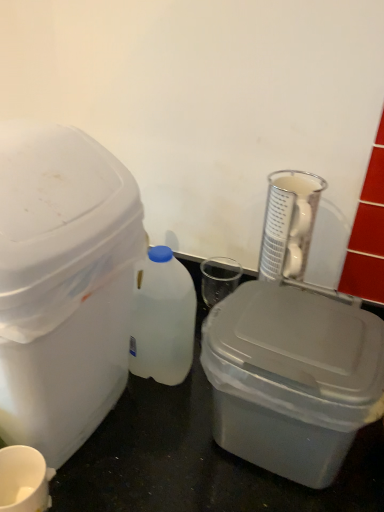
Question: From the image's perspective, is white plastic bottle at center below white matte cup at lower left?

Choices:
 (A) no
 (B) yes

Answer: (A)

Question: Does white plastic bottle at center have a lesser height compared to white matte cup at lower left?

Choices:
 (A) no
 (B) yes

Answer: (A)

Question: Is white plastic bottle at center at the left side of white matte cup at lower left?

Choices:
 (A) yes
 (B) no

Answer: (B)

Question: Considering the relative sizes of white plastic bottle at center and white matte cup at lower left in the image provided, is white plastic bottle at center bigger than white matte cup at lower left?

Choices:
 (A) yes
 (B) no

Answer: (A)

Question: Is white plastic bottle at center smaller than white matte cup at lower left?

Choices:
 (A) no
 (B) yes

Answer: (A)

Question: Looking at their shapes, would you say white plastic bottle at center is wider or thinner than white plastic storage box at left, marked as the 2th storage box in a right-to-left arrangement?

Choices:
 (A) wide
 (B) thin

Answer: (B)

Question: Is white plastic bottle at center inside or outside of white plastic storage box at left, the first storage box from the left?

Choices:
 (A) inside
 (B) outside

Answer: (B)

Question: Considering the positions of white plastic bottle at center and white plastic storage box at left, marked as the 2th storage box in a right-to-left arrangement, in the image, is white plastic bottle at center bigger or smaller than white plastic storage box at left, marked as the 2th storage box in a right-to-left arrangement,?

Choices:
 (A) small
 (B) big

Answer: (A)

Question: Is point (160, 270) positioned closer to the camera than point (18, 304)?

Choices:
 (A) farther
 (B) closer

Answer: (A)

Question: Is white matte cup at lower left situated inside gray plastic storage box at center, positioned as the 2th storage box in left-to-right order, or outside?

Choices:
 (A) outside
 (B) inside

Answer: (A)

Question: Is point [x=38, y=488] positioned closer to the camera than point [x=244, y=375]?

Choices:
 (A) closer
 (B) farther

Answer: (B)

Question: In the image, is white matte cup at lower left positioned in front of or behind gray plastic storage box at center, which is counted as the 1th storage box, starting from the right?

Choices:
 (A) behind
 (B) front

Answer: (A)

Question: In terms of size, does white matte cup at lower left appear bigger or smaller than gray plastic storage box at center, which is counted as the 1th storage box, starting from the right?

Choices:
 (A) big
 (B) small

Answer: (B)

Question: Considering the positions of white matte cup at lower left and clear glass beaker at upper right in the image, is white matte cup at lower left wider or thinner than clear glass beaker at upper right?

Choices:
 (A) wide
 (B) thin

Answer: (B)

Question: Is white matte cup at lower left inside or outside of clear glass beaker at upper right?

Choices:
 (A) outside
 (B) inside

Answer: (A)